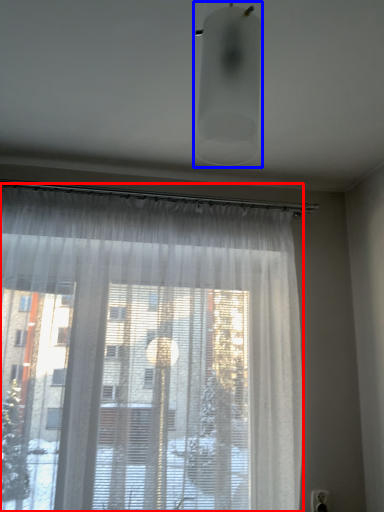
Question: Which object appears farthest to the camera in this image, curtain (highlighted by a red box) or light fixture (highlighted by a blue box)?

Choices:
 (A) curtain
 (B) light fixture

Answer: (A)